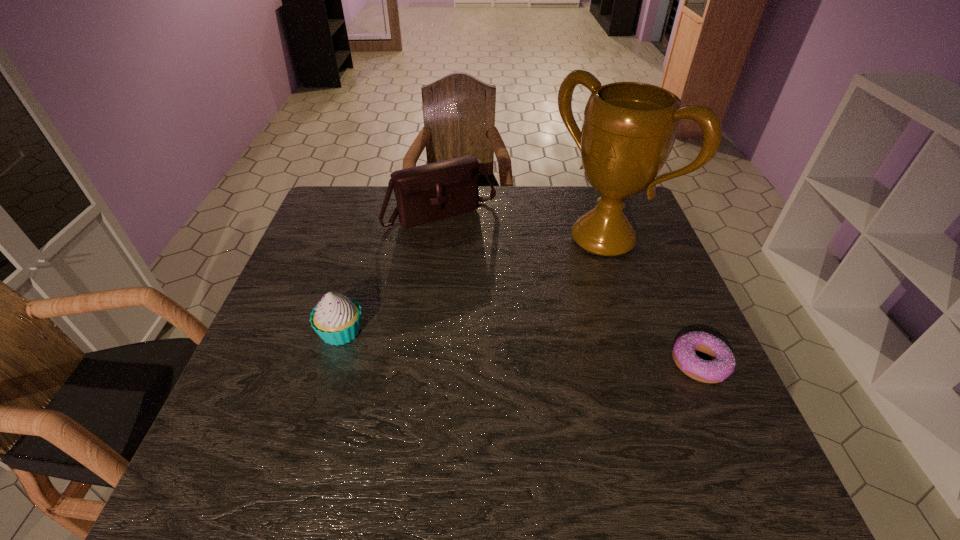
This screenshot has width=960, height=540. Find the location of `vacant area situated 0.160m on the front of the award with the decoration`. vacant area situated 0.160m on the front of the award with the decoration is located at coordinates (532, 292).

Locate an element on the screen. blank space located on the front of the award with the decoration is located at coordinates (493, 321).

At what (x,y) coordinates should I click in order to perform the action: click on shoulder bag located at the far edge. Please return your answer as a coordinate pair (x, y). Looking at the image, I should click on (430, 192).

This screenshot has width=960, height=540. What are the coordinates of `award that is positioned at the far edge` in the screenshot? It's located at (629, 128).

Locate an element on the screen. The width and height of the screenshot is (960, 540). object located at the left edge is located at coordinates (336, 319).

Where is `doughnut located in the right edge section of the desktop`? The image size is (960, 540). doughnut located in the right edge section of the desktop is located at coordinates (722, 365).

Identify the location of award that is at the right edge. This screenshot has width=960, height=540. (629, 128).

Find the location of a particular element. The image size is (960, 540). object that is positioned at the far right corner is located at coordinates (629, 128).

This screenshot has height=540, width=960. In order to click on vacant area at the far edge in this screenshot , I will do `click(560, 192)`.

Find the location of a particular element. The image size is (960, 540). vacant region at the left edge is located at coordinates (314, 294).